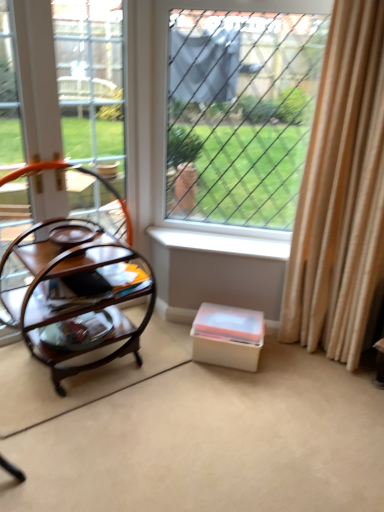
Image resolution: width=384 pixels, height=512 pixels. Find the location of `white plastic storage box at lower center`. white plastic storage box at lower center is located at coordinates 227,336.

The height and width of the screenshot is (512, 384). Describe the element at coordinates (63, 85) in the screenshot. I see `wooden frame at left` at that location.

Find the location of a particular element. wire mesh at center is located at coordinates (240, 114).

Is wooden frame at left a part of beige fabric curtain at right?

No, beige fabric curtain at right does not contain wooden frame at left.

From a real-world perspective, which object stands above the other?

beige fabric curtain at right, from a real-world perspective.

Is beige fabric curtain at right directly adjacent to woodenmaterial/texturetable at left?

No, beige fabric curtain at right is not beside woodenmaterial/texturetable at left.

Is beige fabric curtain at right surrounding woodenmaterial/texturetable at left?

No, beige fabric curtain at right does not contain woodenmaterial/texturetable at left.

What's the angular difference between beige fabric curtain at right and woodenmaterial/texturetable at left's facing directions?

The angular difference between beige fabric curtain at right and woodenmaterial/texturetable at left is 47.2 degrees.

Measure the distance from woodenmaterial/texturetable at left to wire mesh at center.

woodenmaterial/texturetable at left and wire mesh at center are 35.59 inches apart.

From a real-world perspective, relative to wire mesh at center, is woodenmaterial/texturetable at left vertically above or below?

From a real-world perspective, woodenmaterial/texturetable at left is physically below wire mesh at center.

What are the coordinates of `table below the wire mesh at center (from the image's perspective)` in the screenshot? It's located at (76, 295).

Can you tell me how much woodenmaterial/texturetable at left and wire mesh at center differ in facing direction?

There is a 45.6-degree angle between the facing directions of woodenmaterial/texturetable at left and wire mesh at center.

Could you tell me if woodenmaterial/texturetable at left is turned towards white plastic storage box at lower center?

No.

Who is shorter, woodenmaterial/texturetable at left or white plastic storage box at lower center?

With less height is white plastic storage box at lower center.

From a real-world perspective, is woodenmaterial/texturetable at left physically located above or below white plastic storage box at lower center?

In terms of real-world spatial position, woodenmaterial/texturetable at left is above white plastic storage box at lower center.

Is woodenmaterial/texturetable at left in contact with white plastic storage box at lower center?

No.

Does white plastic window sill at center turn towards wooden frame at left?

No, white plastic window sill at center is not turned towards wooden frame at left.

Considering the positions of points (198, 246) and (109, 48), is point (198, 246) farther from camera compared to point (109, 48)?

Yes, it is.

Can you confirm if white plastic window sill at center is thinner than wooden frame at left?

No, white plastic window sill at center is not thinner than wooden frame at left.

Find the location of `window sill that appears below the wooden frame at left (from the image's perspective)`. window sill that appears below the wooden frame at left (from the image's perspective) is located at coordinates (220, 242).

Considering the sizes of objects white plastic window sill at center and beige fabric curtain at right in the image provided, who is thinner, white plastic window sill at center or beige fabric curtain at right?

white plastic window sill at center.

Is white plastic window sill at center positioned far away from beige fabric curtain at right?

No, there isn't a large distance between white plastic window sill at center and beige fabric curtain at right.

Does white plastic window sill at center turn towards beige fabric curtain at right?

No.

Considering the points (224, 239) and (370, 183), which point is in front, point (224, 239) or point (370, 183)?

The point (370, 183) is more forward.

Which is behind, woodenmaterial/texturetable at left or wooden frame at left?

Positioned behind is wooden frame at left.

From the picture: Which is more to the left, woodenmaterial/texturetable at left or wooden frame at left?

Positioned to the left is wooden frame at left.

Is woodenmaterial/texturetable at left oriented towards wooden frame at left?

No, woodenmaterial/texturetable at left is not facing towards wooden frame at left.

Which point is more forward, (114, 267) or (117, 215)?

Positioned in front is point (114, 267).

Where is `curtain to the right of wooden frame at left`? curtain to the right of wooden frame at left is located at coordinates (341, 193).

You are a GUI agent. You are given a task and a screenshot of the screen. Output one action in this format:
    pyautogui.click(x=<x>, y=<y>)
    Task: Click on the curtain above the woodenmaterial/texturetable at left (from a real-world perspective)
    
    Given the screenshot: What is the action you would take?
    point(341,193)

Looking at the image, which one is located further to wire mesh at center, white plastic window sill at center or wooden frame at left?

wooden frame at left is further to wire mesh at center.

Based on their spatial positions, is wooden frame at left or woodenmaterial/texturetable at left closer to beige fabric curtain at right?

Based on the image, woodenmaterial/texturetable at left appears to be nearer to beige fabric curtain at right.

Considering their positions, is white plastic window sill at center positioned further to beige fabric curtain at right than white plastic storage box at lower center?

Answer: Based on the image, white plastic storage box at lower center appears to be further to beige fabric curtain at right.

Estimate the real-world distances between objects in this image. Which object is further from wooden frame at left, beige fabric curtain at right or woodenmaterial/texturetable at left?

beige fabric curtain at right is further to wooden frame at left.

Which object lies nearer to the anchor point wooden frame at left, white plastic window sill at center or beige fabric curtain at right?

white plastic window sill at center lies closer to wooden frame at left than the other object.

When comparing their distances from wooden frame at left, does woodenmaterial/texturetable at left or beige fabric curtain at right seem further?

Based on the image, beige fabric curtain at right appears to be further to wooden frame at left.

Considering their positions, is beige fabric curtain at right positioned further to white plastic window sill at center than wooden frame at left?

Based on the image, wooden frame at left appears to be further to white plastic window sill at center.

Looking at the image, which one is located further to beige fabric curtain at right, wooden frame at left or wire mesh at center?

wooden frame at left.

Image resolution: width=384 pixels, height=512 pixels. I want to click on window sill between woodenmaterial/texturetable at left and white plastic storage box at lower center, so click(220, 242).

You are a GUI agent. You are given a task and a screenshot of the screen. Output one action in this format:
    pyautogui.click(x=<x>, y=<y>)
    Task: Click on the table situated between wooden frame at left and beige fabric curtain at right from left to right
    This screenshot has height=512, width=384.
    Given the screenshot: What is the action you would take?
    pyautogui.click(x=76, y=295)

At what (x,y) coordinates should I click in order to perform the action: click on window screen positioned between beige fabric curtain at right and white plastic window sill at center from near to far. Please return your answer as a coordinate pair (x, y). The width and height of the screenshot is (384, 512). Looking at the image, I should click on (240, 114).

You are a GUI agent. You are given a task and a screenshot of the screen. Output one action in this format:
    pyautogui.click(x=<x>, y=<y>)
    Task: Click on the table between wire mesh at center and white plastic storage box at lower center vertically
    The height and width of the screenshot is (512, 384).
    Given the screenshot: What is the action you would take?
    pyautogui.click(x=76, y=295)